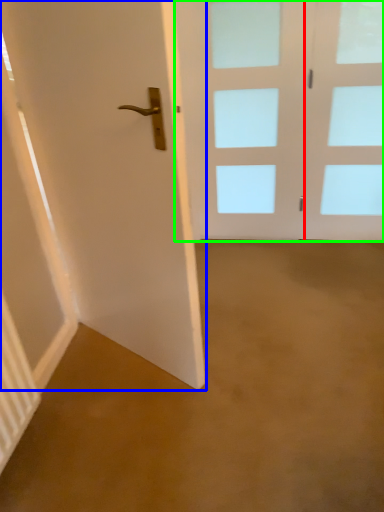
Question: Which object is positioned closest to glass door (highlighted by a red box)? Select from door (highlighted by a blue box) and door (highlighted by a green box).

Choices:
 (A) door
 (B) door

Answer: (B)